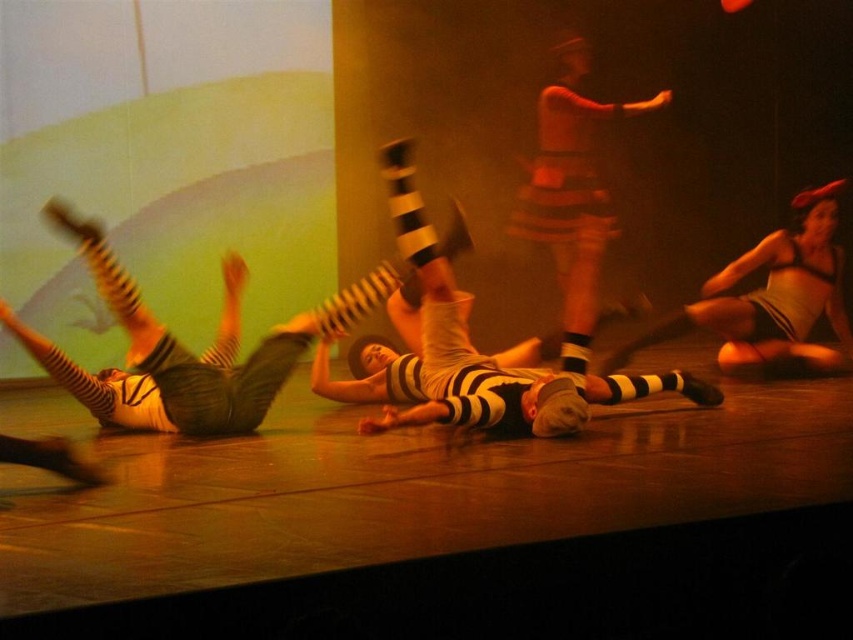
You are a costume designer preparing for a dance performance. You have two items to place on a rack in the dressing room. The items are the white striped socks at center and the matte white swimsuit at right. If you want to arrange them side by side, which item should you place first to accommodate their widths?

The white striped socks at center has a larger width than the matte white swimsuit at right, so you should place the white striped socks at center first to ensure there is enough space for both items on the rack.